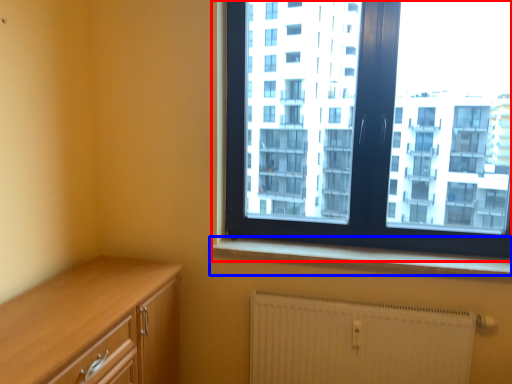
Question: Which point is further to the camera, window (highlighted by a red box) or window sill (highlighted by a blue box)?

Choices:
 (A) window
 (B) window sill

Answer: (B)